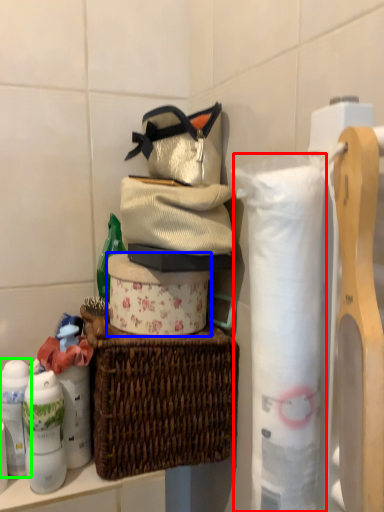
Question: Which object is the farthest from toilet paper (highlighted by a red box)? Choose among these: toilet paper (highlighted by a blue box) or toiletry (highlighted by a green box).

Choices:
 (A) toilet paper
 (B) toiletry

Answer: (B)